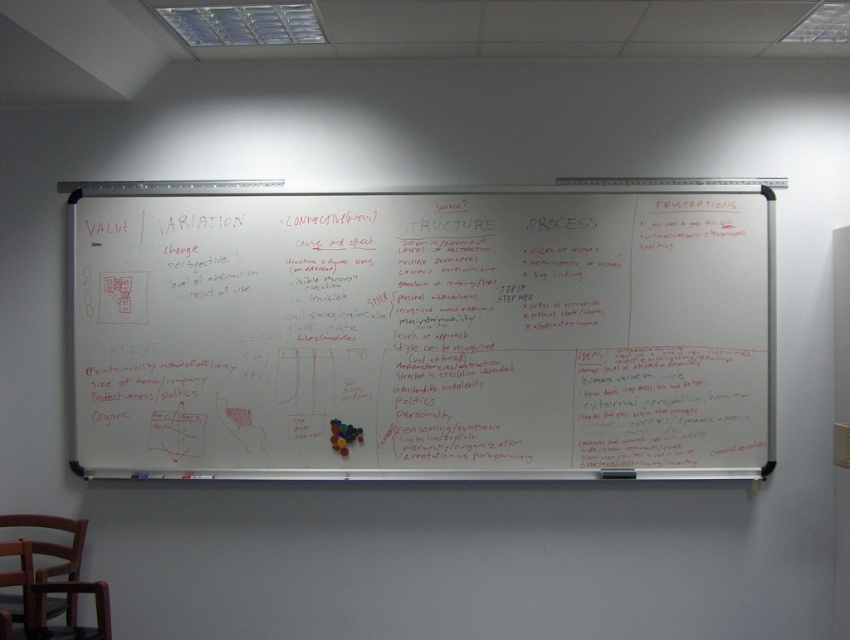
Question: Is the position of whiteboard at center less distant than that of brown wooden chair at lower left?

Choices:
 (A) no
 (B) yes

Answer: (A)

Question: Which of the following is the closest to the observer?

Choices:
 (A) (98, 380)
 (B) (68, 579)

Answer: (B)

Question: Does whiteboard at center appear over brown wooden chair at lower left?

Choices:
 (A) no
 (B) yes

Answer: (B)

Question: Which of the following is the farthest from the observer?

Choices:
 (A) (69, 552)
 (B) (117, 397)

Answer: (B)

Question: Can you confirm if whiteboard at center is positioned below brown wooden chair at lower left?

Choices:
 (A) yes
 (B) no

Answer: (B)